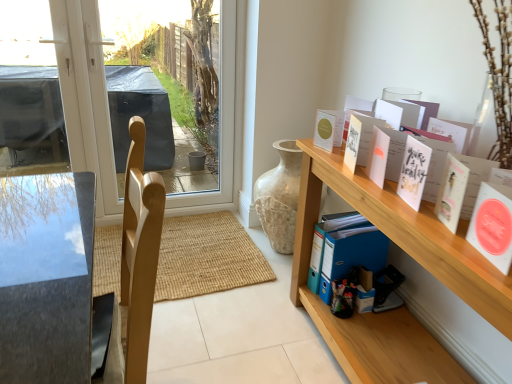
What is the approximate height of transparent glass window at upper left?

transparent glass window at upper left is 1.26 meters tall.

What do you see at coordinates (86, 102) in the screenshot? I see `transparent glass window at upper left` at bounding box center [86, 102].

I want to click on matte white card at upper right, which is the 1th book from back to front, so click(x=324, y=130).

Is white paper card at upper right, arranged as the 3th book when viewed from the front, to the left or to the right of white paper card at upper right, marked as the 2th book in a front-to-back arrangement, in the image?

white paper card at upper right, arranged as the 3th book when viewed from the front, is to the left of white paper card at upper right, marked as the 2th book in a front-to-back arrangement.

Would you consider white paper card at upper right, arranged as the 3th book when viewed from the front, to be distant from white paper card at upper right, marked as the 2th book in a front-to-back arrangement?

They are positioned close to each other.

Considering the relative positions of white paper card at upper right, the second book when ordered from back to front, and white paper card at upper right, marked as the 2th book in a front-to-back arrangement, in the image provided, is white paper card at upper right, the second book when ordered from back to front, behind white paper card at upper right, marked as the 2th book in a front-to-back arrangement,?

Yes, it is.

Is white paper card at upper right, the second book when ordered from back to front, aimed at white paper card at upper right, the 3th book from the back?

No, white paper card at upper right, the second book when ordered from back to front, does not turn towards white paper card at upper right, the 3th book from the back.

Would you consider white paper card at upper right, the second book when ordered from back to front, to be distant from matte white card at upper right, the fourth book in the front-to-back sequence?

white paper card at upper right, the second book when ordered from back to front, is near matte white card at upper right, the fourth book in the front-to-back sequence, not far away.

In the image, is white paper card at upper right, arranged as the 3th book when viewed from the front, on the left side or the right side of matte white card at upper right, the fourth book in the front-to-back sequence?

white paper card at upper right, arranged as the 3th book when viewed from the front, is to the right of matte white card at upper right, the fourth book in the front-to-back sequence.

From the image's perspective, which object appears higher, white paper card at upper right, arranged as the 3th book when viewed from the front, or matte white card at upper right, the fourth book in the front-to-back sequence?

matte white card at upper right, the fourth book in the front-to-back sequence, from the image's perspective.

Is white paper card at upper right, the 3th book from the back, far away from white matte cards at upper right, positioned as the fourth book in back-to-front order?

white paper card at upper right, the 3th book from the back, is near white matte cards at upper right, positioned as the fourth book in back-to-front order, not far away.

Can you confirm if white paper card at upper right, the 3th book from the back, is bigger than white matte cards at upper right, positioned as the fourth book in back-to-front order?

No.

Considering the positions of objects white paper card at upper right, marked as the 2th book in a front-to-back arrangement, and white matte cards at upper right, which is the first book in front-to-back order, in the image provided, who is behind, white paper card at upper right, marked as the 2th book in a front-to-back arrangement, or white matte cards at upper right, which is the first book in front-to-back order,?

white paper card at upper right, marked as the 2th book in a front-to-back arrangement, is further from the camera.

How many degrees apart are the facing directions of matte white card at upper right, which is the 1th book from back to front, and transparent glass window at upper left?

matte white card at upper right, which is the 1th book from back to front, and transparent glass window at upper left are facing 74.1 degrees away from each other.

Does matte white card at upper right, which is the 1th book from back to front, turn towards transparent glass window at upper left?

No, matte white card at upper right, which is the 1th book from back to front, is not facing towards transparent glass window at upper left.

Who is more distant, matte white card at upper right, which is the 1th book from back to front, or transparent glass window at upper left?

transparent glass window at upper left is further away from the camera.

Which book is the 1st one when counting from the right side of the transparent glass window at upper left? Please provide its 2D coordinates.

[(324, 130)]

Would you say matte white card at upper right, the fourth book in the front-to-back sequence, is inside or outside white matte cards at upper right, positioned as the fourth book in back-to-front order?

matte white card at upper right, the fourth book in the front-to-back sequence, lies outside white matte cards at upper right, positioned as the fourth book in back-to-front order.

Looking at this image, relative to white matte cards at upper right, positioned as the fourth book in back-to-front order, is matte white card at upper right, the fourth book in the front-to-back sequence, in front or behind?

In the image, matte white card at upper right, the fourth book in the front-to-back sequence, appears behind white matte cards at upper right, positioned as the fourth book in back-to-front order.

Are matte white card at upper right, the fourth book in the front-to-back sequence, and white matte cards at upper right, which is the first book in front-to-back order, far apart?

No, matte white card at upper right, the fourth book in the front-to-back sequence, is in close proximity to white matte cards at upper right, which is the first book in front-to-back order.

From a real-world perspective, is matte white card at upper right, the fourth book in the front-to-back sequence, above or below white matte cards at upper right, which is the first book in front-to-back order?

In terms of real-world spatial position, matte white card at upper right, the fourth book in the front-to-back sequence, is below white matte cards at upper right, which is the first book in front-to-back order.

Are wooden shelf at right and white paper card at upper right, the 3th book from the back, far apart?

wooden shelf at right is actually quite close to white paper card at upper right, the 3th book from the back.

From the image's perspective, does wooden shelf at right appear lower than white paper card at upper right, marked as the 2th book in a front-to-back arrangement?

Indeed, from the image's perspective, wooden shelf at right is shown beneath white paper card at upper right, marked as the 2th book in a front-to-back arrangement.

From a real-world perspective, is wooden shelf at right positioned above or below white paper card at upper right, the 3th book from the back?

wooden shelf at right is situated lower than white paper card at upper right, the 3th book from the back, in the real world.

Is point (317, 306) more distant than point (472, 217)?

Yes, point (317, 306) is behind point (472, 217).

Considering the relative sizes of wooden shelf at right and white paper card at upper right, the second book when ordered from back to front, in the image provided, is wooden shelf at right bigger than white paper card at upper right, the second book when ordered from back to front,?

Yes, wooden shelf at right is bigger than white paper card at upper right, the second book when ordered from back to front.

What's the angular difference between wooden shelf at right and white paper card at upper right, arranged as the 3th book when viewed from the front,'s facing directions?

wooden shelf at right and white paper card at upper right, arranged as the 3th book when viewed from the front, are facing 9.01 degrees away from each other.

Visually, is wooden shelf at right positioned to the left or to the right of white paper card at upper right, arranged as the 3th book when viewed from the front?

wooden shelf at right is to the right of white paper card at upper right, arranged as the 3th book when viewed from the front.

Considering the relative sizes of wooden shelf at right and white paper card at upper right, arranged as the 3th book when viewed from the front, in the image provided, is wooden shelf at right thinner than white paper card at upper right, arranged as the 3th book when viewed from the front,?

In fact, wooden shelf at right might be wider than white paper card at upper right, arranged as the 3th book when viewed from the front.

At what (x,y) coordinates should I click in order to perform the action: click on the 2nd book counting from the right side of the white paper card at upper right, the second book when ordered from back to front. Please return your answer as a coordinate pair (x, y). Looking at the image, I should click on (493, 225).

What are the coordinates of `the 2nd book positioned above the white paper card at upper right, arranged as the 3th book when viewed from the front (from the image's perspective)` in the screenshot? It's located at (324, 130).

Based on their spatial positions, is white matte cards at upper right, which is the first book in front-to-back order, or transparent glass window at upper left closer to white paper card at upper right, marked as the 2th book in a front-to-back arrangement?

white matte cards at upper right, which is the first book in front-to-back order, lies closer to white paper card at upper right, marked as the 2th book in a front-to-back arrangement, than the other object.

Looking at the image, which one is located further to white paper card at upper right, arranged as the 3th book when viewed from the front, white matte cards at upper right, which is the first book in front-to-back order, or white paper card at upper right, the 3th book from the back?

Based on the image, white paper card at upper right, the 3th book from the back, appears to be further to white paper card at upper right, arranged as the 3th book when viewed from the front.

Which object lies nearer to the anchor point transparent glass window at upper left, white paper card at upper right, the second book when ordered from back to front, or white matte cards at upper right, which is the first book in front-to-back order?

white paper card at upper right, the second book when ordered from back to front, is positioned closer to the anchor transparent glass window at upper left.

From the image, which object appears to be nearer to white paper card at upper right, marked as the 2th book in a front-to-back arrangement, wooden shelf at right or white matte cards at upper right, positioned as the fourth book in back-to-front order?

white matte cards at upper right, positioned as the fourth book in back-to-front order, is closer to white paper card at upper right, marked as the 2th book in a front-to-back arrangement.

Based on their spatial positions, is wooden shelf at right or white paper card at upper right, the 3th book from the back, closer to white paper card at upper right, arranged as the 3th book when viewed from the front?

white paper card at upper right, the 3th book from the back, is closer to white paper card at upper right, arranged as the 3th book when viewed from the front.

Considering their positions, is transparent glass window at upper left positioned closer to matte white card at upper right, the fourth book in the front-to-back sequence, than white matte cards at upper right, which is the first book in front-to-back order?

white matte cards at upper right, which is the first book in front-to-back order, is closer to matte white card at upper right, the fourth book in the front-to-back sequence.

When comparing their distances from wooden shelf at right, does white paper card at upper right, arranged as the 3th book when viewed from the front, or white paper card at upper right, the 3th book from the back, seem further?

white paper card at upper right, the 3th book from the back.

Which object lies nearer to the anchor point wooden shelf at right, white paper card at upper right, marked as the 2th book in a front-to-back arrangement, or white paper card at upper right, arranged as the 3th book when viewed from the front?

white paper card at upper right, arranged as the 3th book when viewed from the front, is closer to wooden shelf at right.

Locate an element on the screen. This screenshot has width=512, height=384. book between white paper card at upper right, arranged as the 3th book when viewed from the front, and wooden shelf at right, in the vertical direction is located at coordinates (493, 225).

Image resolution: width=512 pixels, height=384 pixels. In order to click on book located between white matte cards at upper right, positioned as the fourth book in back-to-front order, and white paper card at upper right, the second book when ordered from back to front, in the depth direction in this screenshot , I will do `click(493, 225)`.

The height and width of the screenshot is (384, 512). In order to click on shelf between transparent glass window at upper left and white paper card at upper right, marked as the 2th book in a front-to-back arrangement, from left to right in this screenshot , I will do click(x=412, y=260).

The width and height of the screenshot is (512, 384). Find the location of `shelf between transparent glass window at upper left and white matte cards at upper right, which is the first book in front-to-back order, from left to right`. shelf between transparent glass window at upper left and white matte cards at upper right, which is the first book in front-to-back order, from left to right is located at coordinates (412, 260).